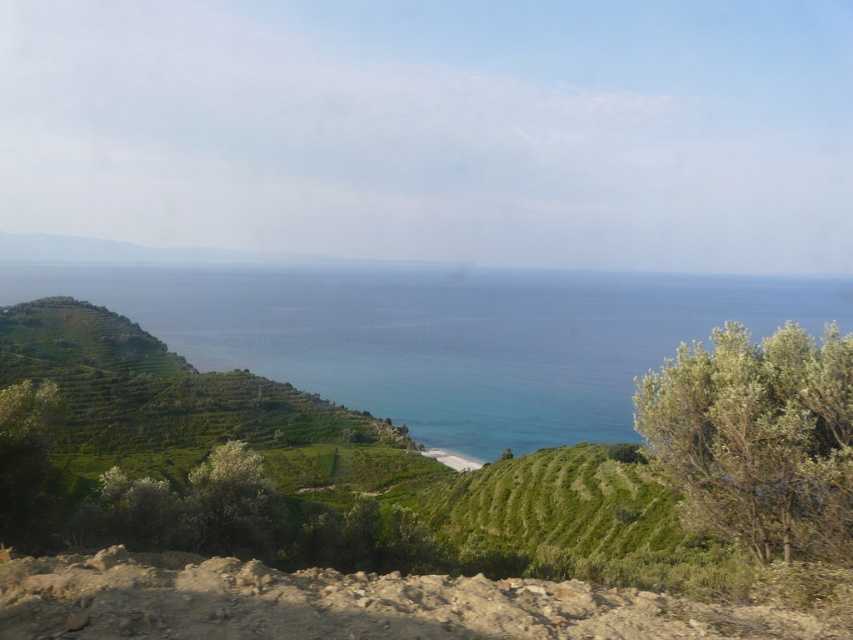
Question: Is blue clear water at center positioned in front of brown dirt at lower left?

Choices:
 (A) yes
 (B) no

Answer: (B)

Question: Can you confirm if brown dirt at lower left is wider than green leafy bush at right?

Choices:
 (A) no
 (B) yes

Answer: (B)

Question: Is blue clear water at center in front of green leafy bush at right?

Choices:
 (A) no
 (B) yes

Answer: (A)

Question: Which point is farther to the camera?

Choices:
 (A) (833, 392)
 (B) (477, 596)

Answer: (A)

Question: Which object is the closest to the brown dirt at lower left?

Choices:
 (A) blue clear water at center
 (B) green leafy bush at right

Answer: (B)

Question: Which of the following is the closest to the observer?

Choices:
 (A) (828, 403)
 (B) (387, 605)

Answer: (B)